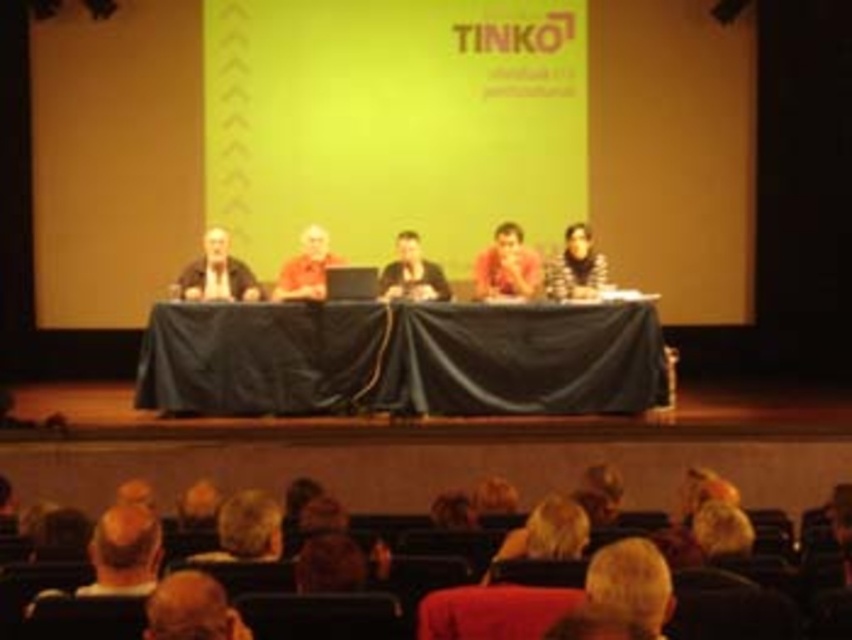
You are an attendee sitting in the front row of the conference hall. You notice the black clothed table at center and the matte orange shirt at center. Which object is positioned lower in the image?

The black clothed table at center is positioned lower than the matte orange shirt at center in the image.

In the scene shown: You are attending the TINKO conference and notice two panelists wearing matte black shirt at center and matte orange shirt at center. Which one has a shorter length?

The matte black shirt at center is shorter than the matte orange shirt at center.